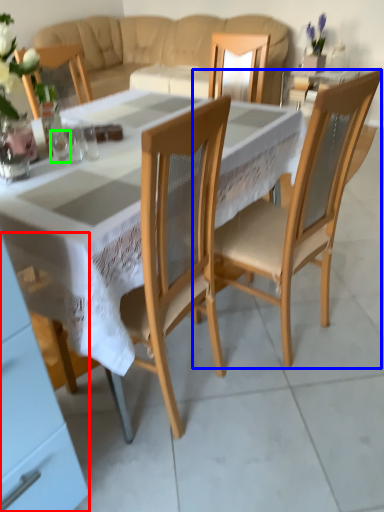
Question: Based on their relative distances, which object is farther from cabinetry (highlighted by a red box)? Choose from chair (highlighted by a blue box) and tableware (highlighted by a green box).

Choices:
 (A) chair
 (B) tableware

Answer: (A)